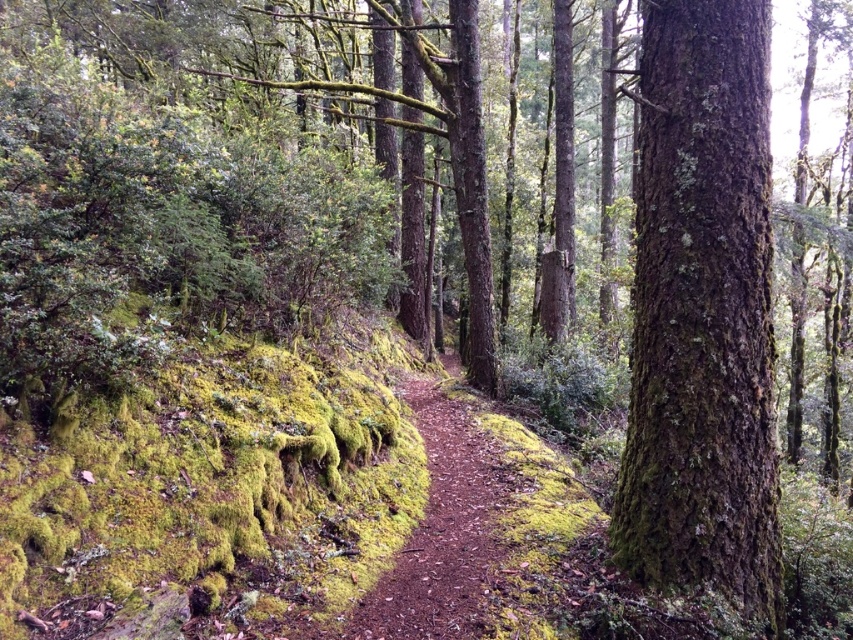
Question: Which of the following is the closest to the observer?

Choices:
 (A) (758, 99)
 (B) (474, 476)

Answer: (A)

Question: Among these points, which one is nearest to the camera?

Choices:
 (A) (676, 554)
 (B) (473, 512)

Answer: (A)

Question: Can you confirm if green mossy bark tree at center is smaller than brown dirt path at center?

Choices:
 (A) yes
 (B) no

Answer: (A)

Question: Is green mossy bark tree at center wider than brown dirt path at center?

Choices:
 (A) yes
 (B) no

Answer: (A)

Question: Which object is farther from the camera taking this photo?

Choices:
 (A) brown dirt path at center
 (B) green mossy bark tree at center

Answer: (B)

Question: Is green mossy bark tree at center below brown dirt path at center?

Choices:
 (A) no
 (B) yes

Answer: (A)